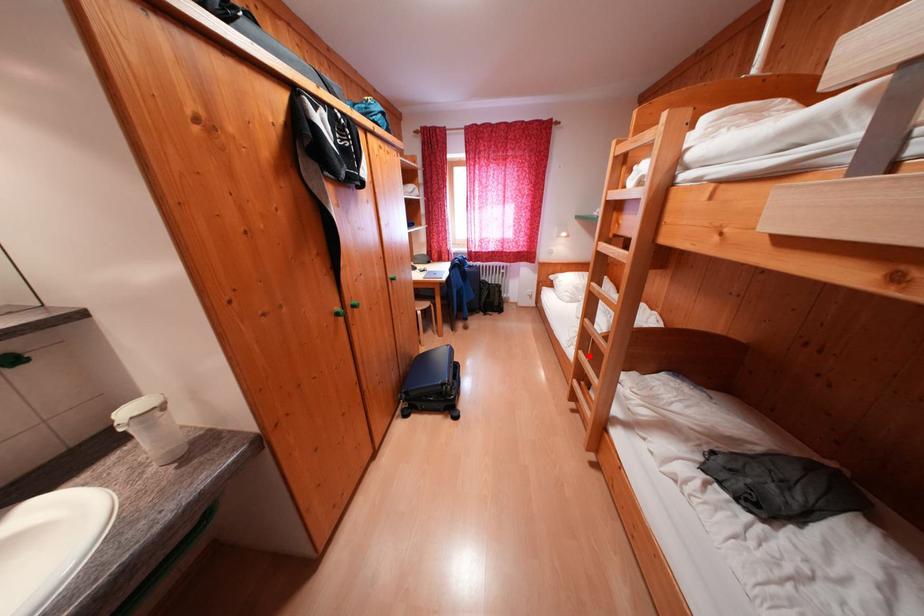
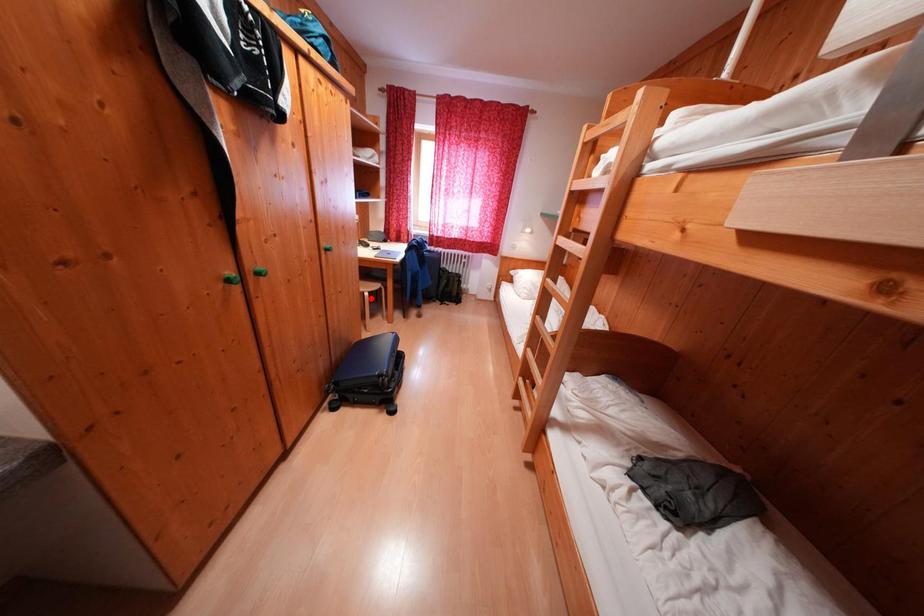
Based on the photo, I am providing you with two images of the same scene from different viewpoints. A red point is marked on the first image and another point is marked on the second image. Is the marked point in image1 the same physical position as the marked point in image2?

No